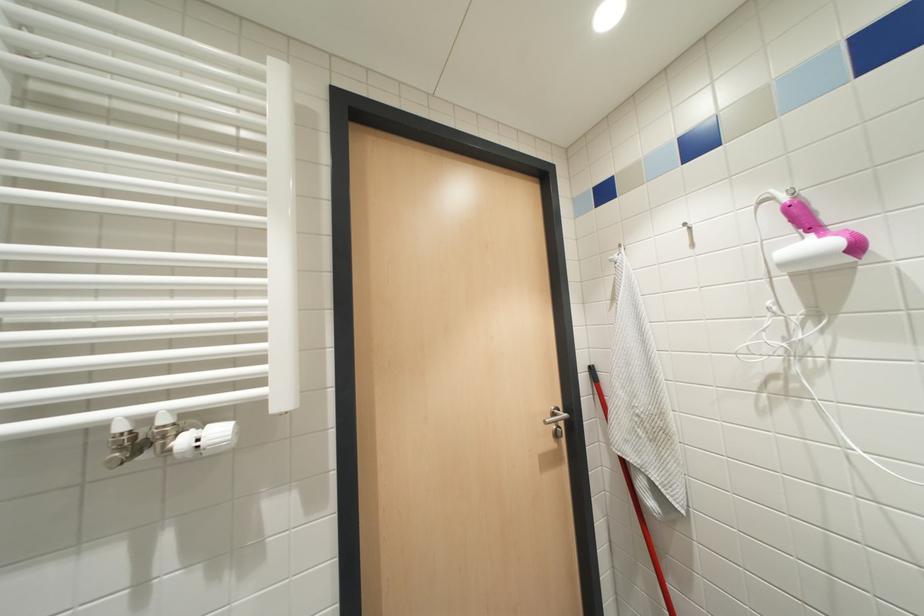
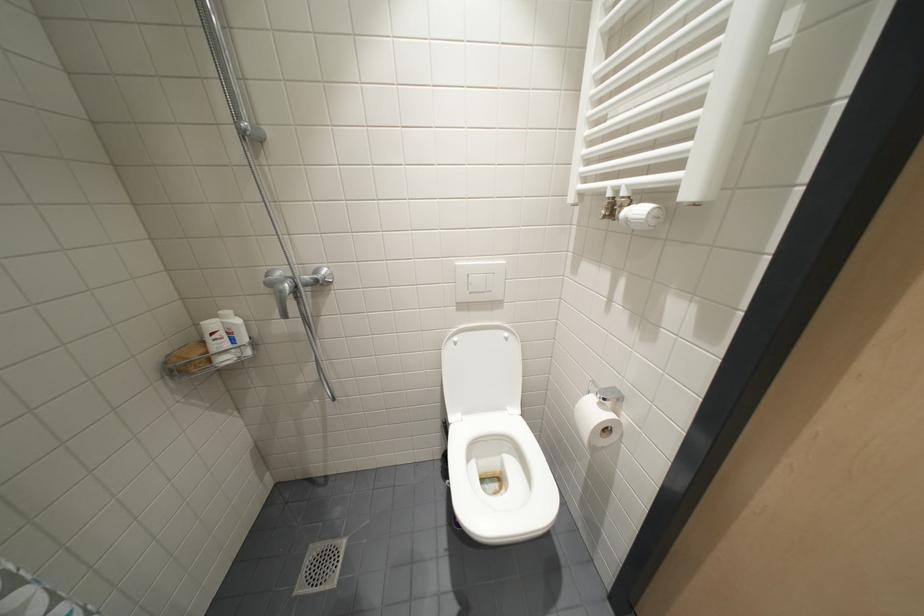
Based on the continuous images, in which direction is the camera rotating?

The rotation direction of the camera is left-down.